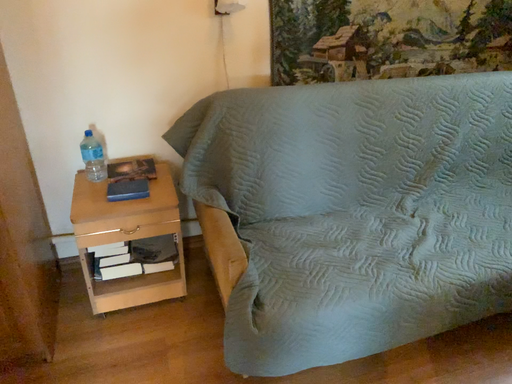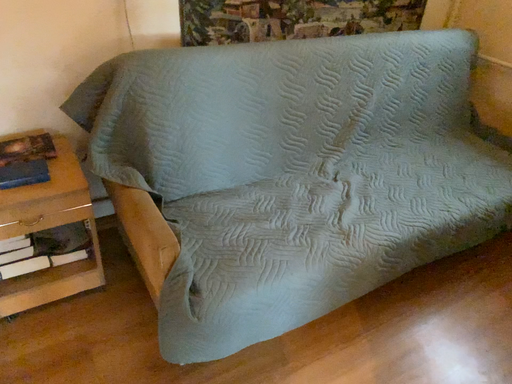
Question: Which way did the camera rotate in the video?

Choices:
 (A) rotated right
 (B) rotated left

Answer: (A)